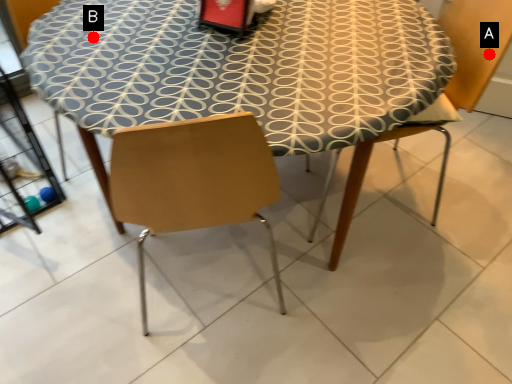
Question: Two points are circled on the image, labeled by A and B beside each circle. Which of the following is the closest to the observer?

Choices:
 (A) A is closer
 (B) B is closer

Answer: (B)